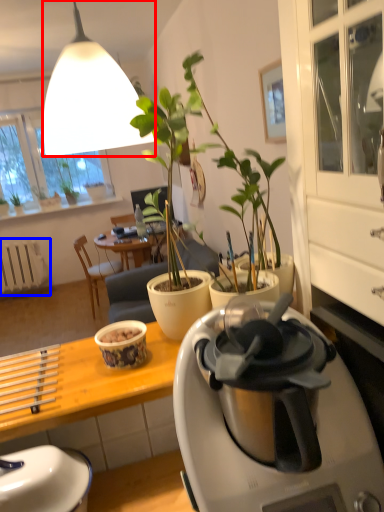
Question: Which object is closer to the camera taking this photo, lamp (highlighted by a red box) or radiator (highlighted by a blue box)?

Choices:
 (A) lamp
 (B) radiator

Answer: (A)